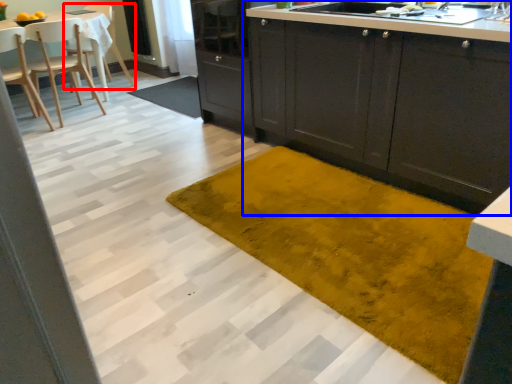
Question: Among these objects, which one is nearest to the camera, chair (highlighted by a red box) or cabinetry (highlighted by a blue box)?

Choices:
 (A) chair
 (B) cabinetry

Answer: (B)